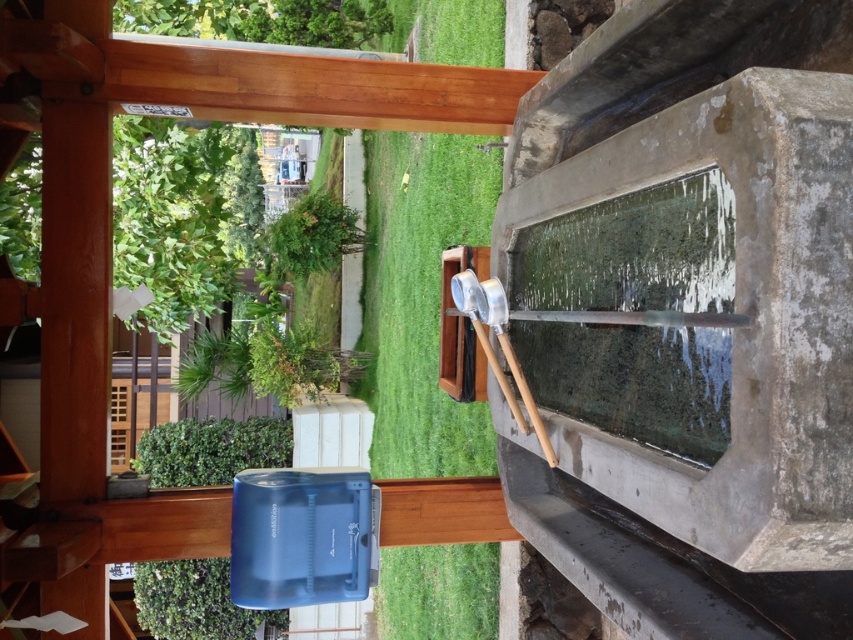
You are standing at the wooden structure with a roof and want to walk towards the green grass at center. Which direction should you walk relative to the green leafy plant at upper center?

The green grass at center is to the right of the green leafy plant at upper center, so you should walk to the right of the green leafy plant at upper center to reach the green grass at center.

You are standing at the origin point of the image coordinate system. The fountain is to your right. Where is the green grass at center located in relation to the fountain?

The green grass at center is located at point (421,298) in the image coordinate system, which is to the left of the fountain since the fountain is to your right.

From the picture: You are planning to place a small bench in the outdoor setting. The bench requires a space wider than the green grass at center. Can the blue plastic plant at lower left provide enough width for the bench?

The green grass at center has a lesser width compared to blue plastic plant at lower left, so the blue plastic plant at lower left has enough width to accommodate the bench.